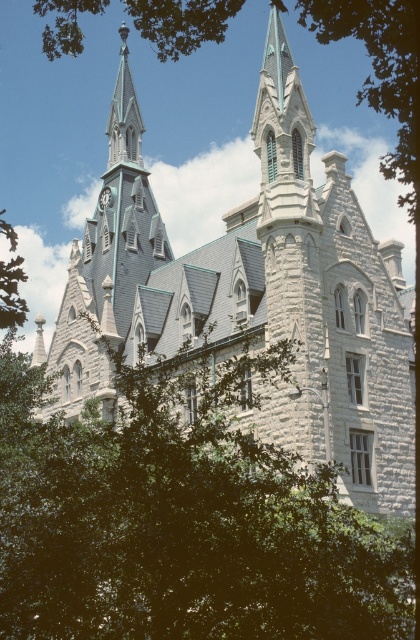
You are standing in front of the grand stone building and want to take a photo of the two spires. To avoid including the green leafy tree at lower left in your photo, where should you position yourself relative to the tree?

To avoid including the green leafy tree at lower left in your photo, you should position yourself to the right of the tree since it is located at point 0.811 on the x axis, meaning it is closer to the right side of the image. By standing to the right of the tree, you can frame the shot so the tree is out of the camera view while capturing the spires.

You are standing in front of the grand stone building and notice the green leafy tree at lower left and the gray stone clock tower at center. Which object is closer to the ground?

The green leafy tree at lower left is positioned under the gray stone clock tower at center, so it is closer to the ground.

You are standing in front of the grand stone building and want to take a photo that includes both the green leafy tree at lower left and the gray stone clock tower at center. Which object should you position closer to the edge of the frame to ensure both are fully visible?

You should position the gray stone clock tower at center closer to the edge of the frame because the green leafy tree at lower left is closer to the viewer and will naturally occupy more space in the photo, requiring the tower to be moved inward to fit both within the frame.